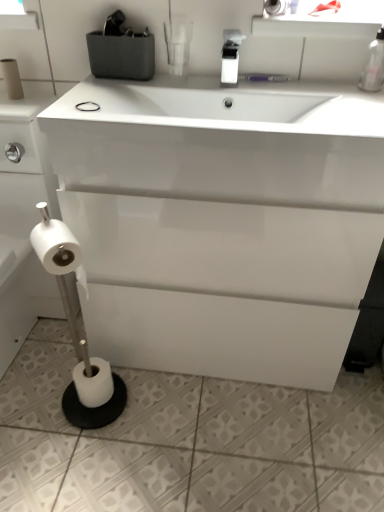
The image size is (384, 512). I want to click on vacant area located to the right-hand side of black rubber band at upper center, so click(137, 109).